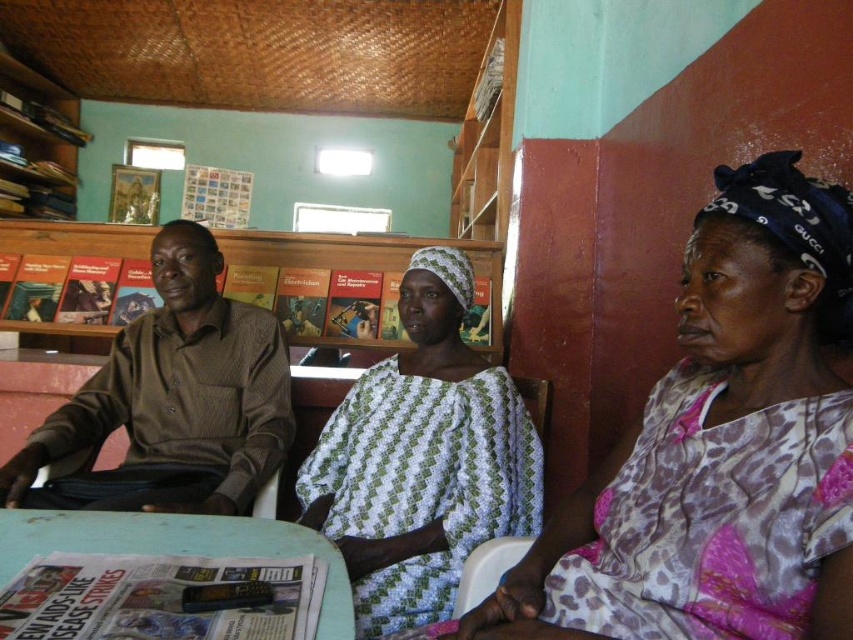
Question: Is white printed fabric at center above brown textured shirt at left?

Choices:
 (A) no
 (B) yes

Answer: (A)

Question: Can you confirm if white printed fabric at center is bigger than brown textured shirt at left?

Choices:
 (A) no
 (B) yes

Answer: (A)

Question: Which of the following is the farthest from the observer?

Choices:
 (A) (598, 520)
 (B) (190, 512)
 (C) (45, 124)
 (D) (39, 524)

Answer: (C)

Question: Which point is closer to the camera taking this photo?

Choices:
 (A) (13, 204)
 (B) (695, 524)

Answer: (B)

Question: Is brown textured shirt at left positioned in front of wooden bookshelf at upper left?

Choices:
 (A) yes
 (B) no

Answer: (A)

Question: Which of these objects is positioned farthest from the white printed fabric at center?

Choices:
 (A) light blue plastic table at lower center
 (B) brown textured shirt at left

Answer: (A)